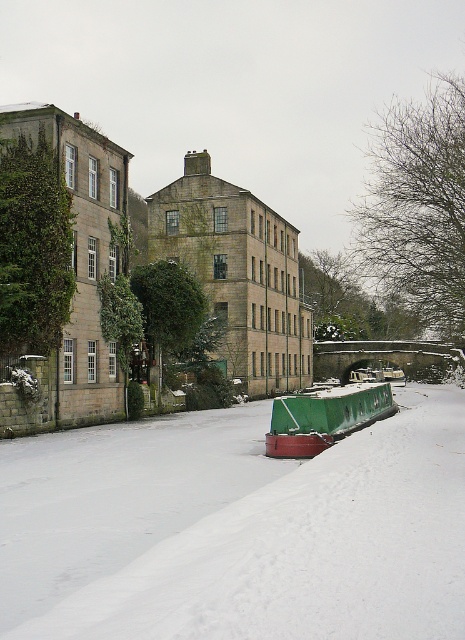
Which is behind, point (352, 456) or point (317, 404)?

The point (317, 404) is more distant.

Does point (347, 493) lie behind point (319, 424)?

No.

The width and height of the screenshot is (465, 640). Identify the location of white matte snow at center. (237, 529).